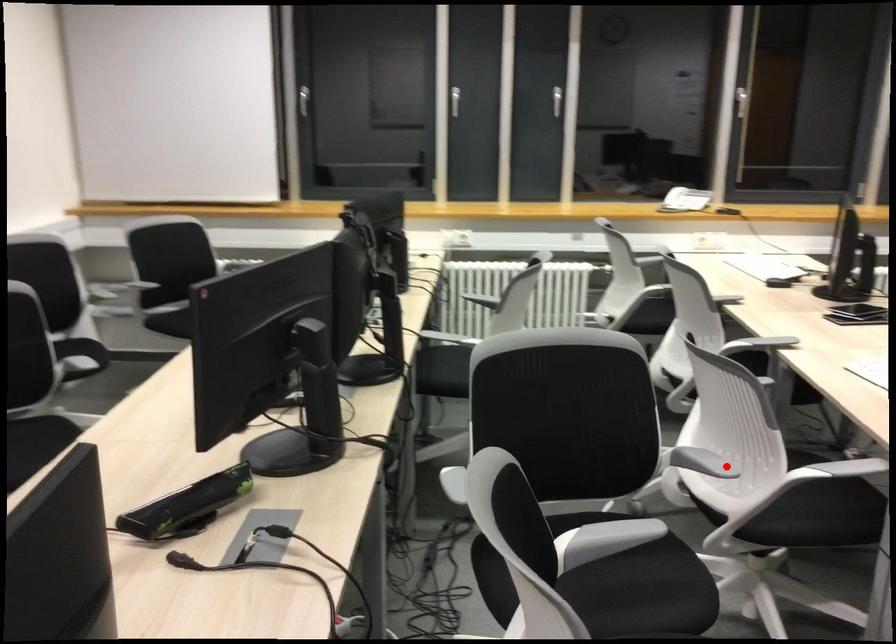
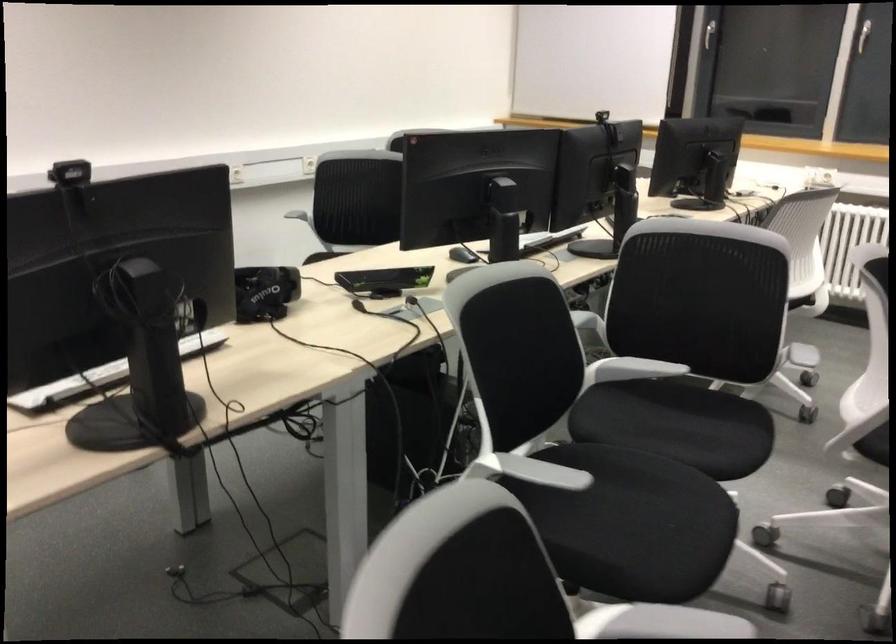
Locate, in the second image, the point that corresponds to the highlighted location in the first image.

(803, 355)